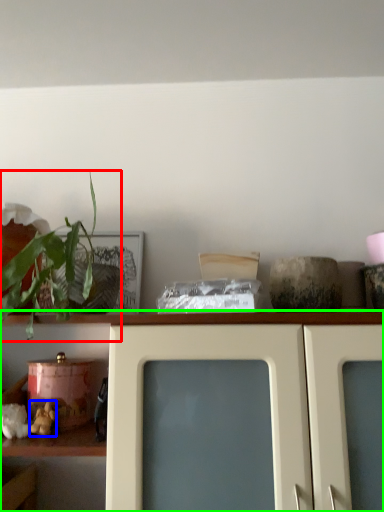
Question: Estimate the real-world distances between objects in this image. Which object is closer to houseplant (highlighted by a red box), stuff (highlighted by a blue box) or shelf (highlighted by a green box)?

Choices:
 (A) stuff
 (B) shelf

Answer: (B)